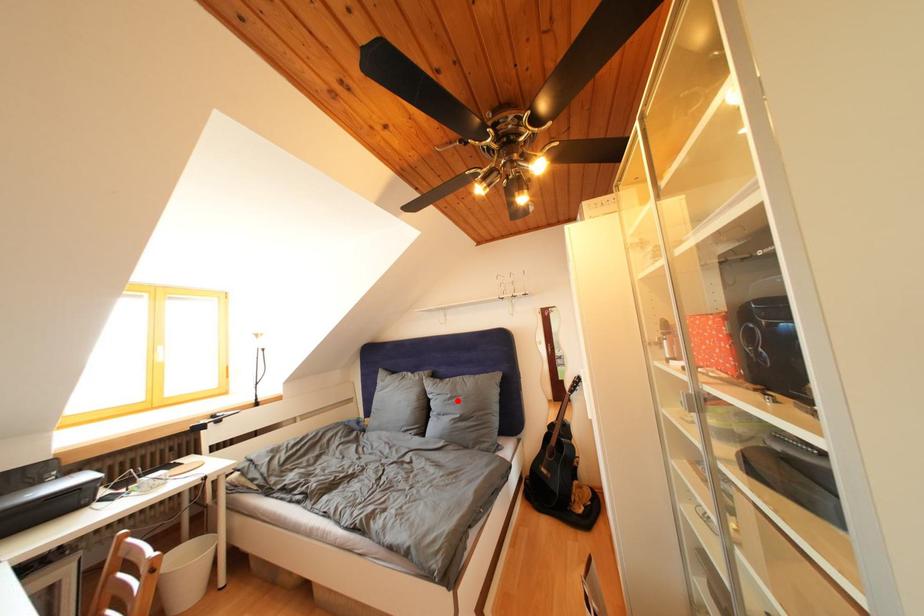
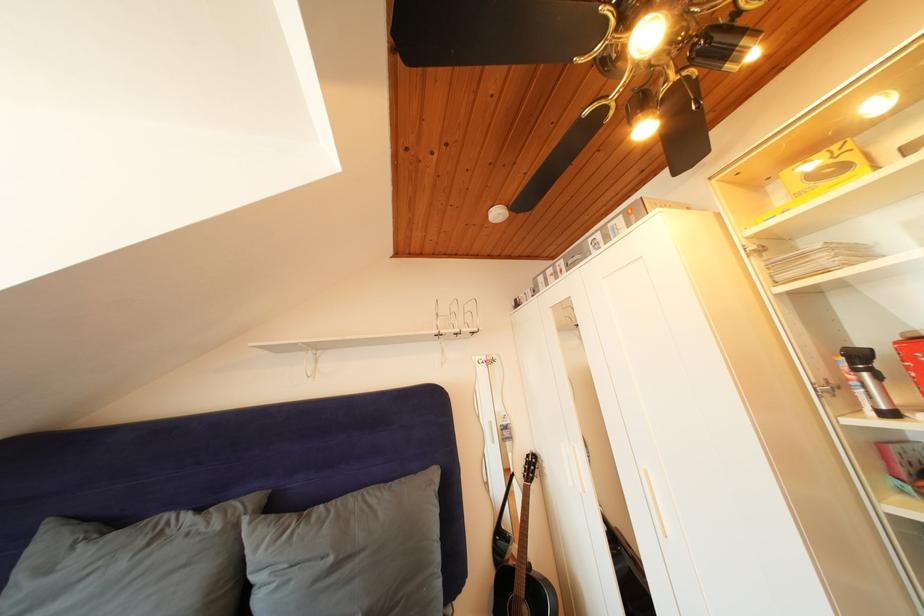
The point at the highlighted location is marked in the first image. Where is the corresponding point in the second image?

(338, 565)